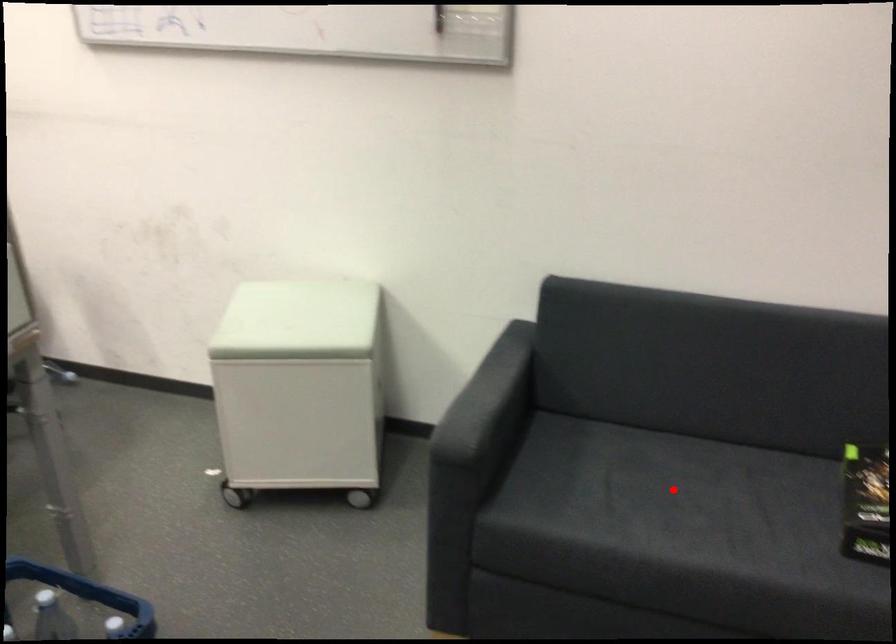
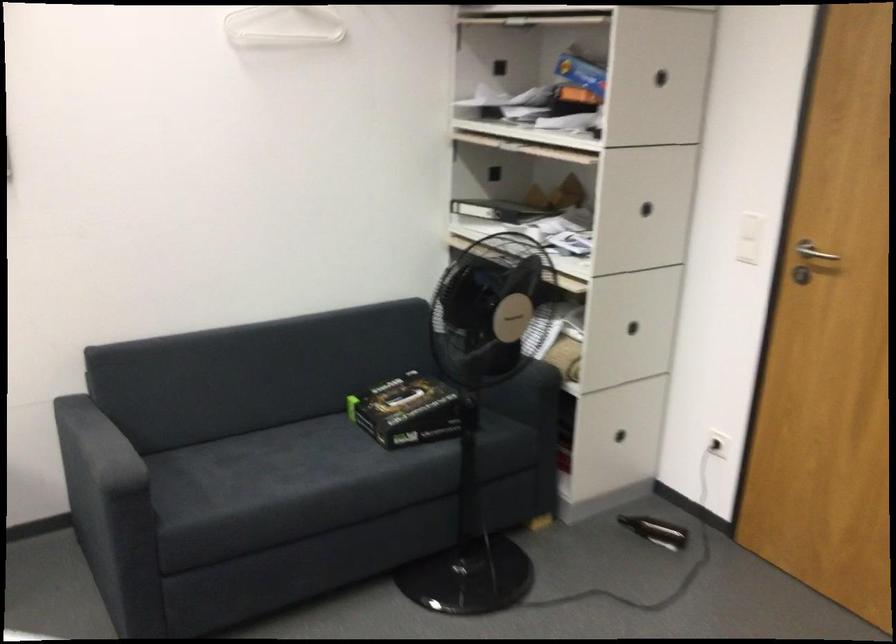
Question: I am providing you with two images of the same scene from different viewpoints. In image1, a red point is highlighted. Considering the same 3D point in image2, which of the following is correct?

Choices:
 (A) It is closer
 (B) It is farther

Answer: (B)